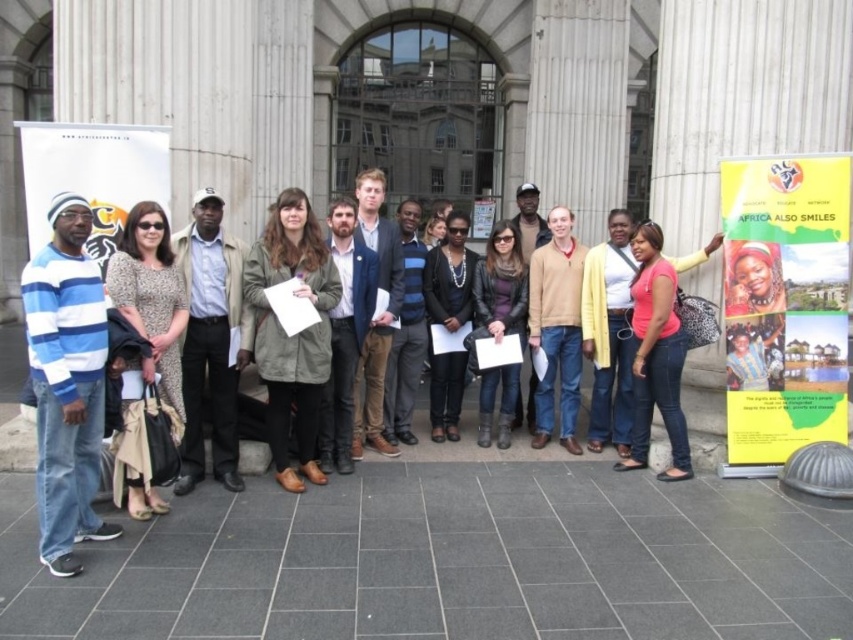
Question: Which object is the farthest from the light brown leather jacket at center?

Choices:
 (A) yellow paper poster at center right
 (B) tan sweater at center
 (C) blue striped sweater at left

Answer: (A)

Question: Which of these objects is positioned closest to the blue striped sweater at left?

Choices:
 (A) yellow paper poster at center right
 (B) white paper at left
 (C) leather jacket at center

Answer: (B)

Question: Is blue striped sweater at left positioned at the back of light brown leather jacket at center?

Choices:
 (A) no
 (B) yes

Answer: (A)

Question: Is yellow paper poster at center right above tan sweater at center?

Choices:
 (A) no
 (B) yes

Answer: (B)

Question: Which point is farther from the camera taking this photo?

Choices:
 (A) (26, 164)
 (B) (187, 442)
 (C) (579, 288)
 (D) (57, 360)

Answer: (C)

Question: Does light brown leather jacket at center come behind white paper at left?

Choices:
 (A) yes
 (B) no

Answer: (A)